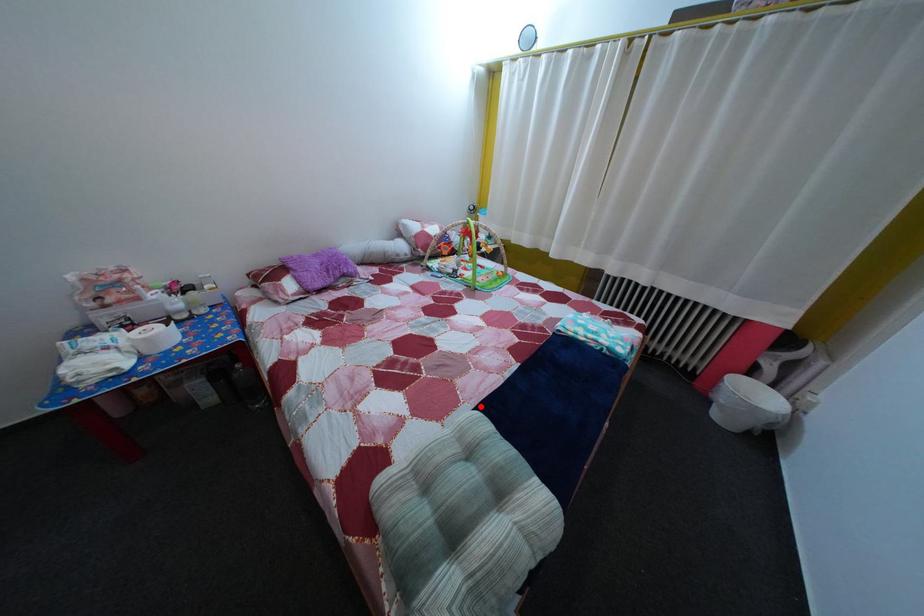
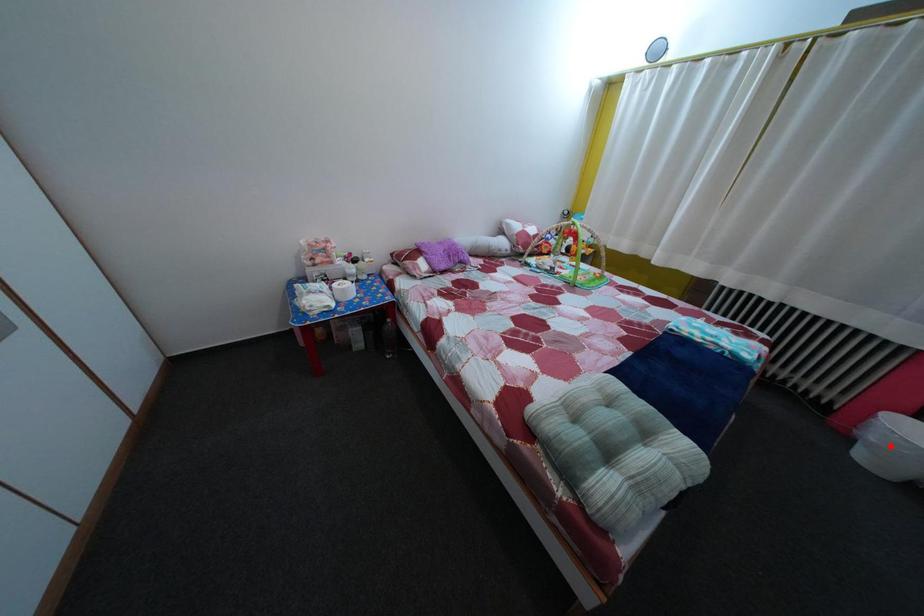
I am providing you with two images of the same scene from different viewpoints. A red point is marked on the first image and another point is marked on the second image. Is the red point in image1 aligned with the point shown in image2?

No